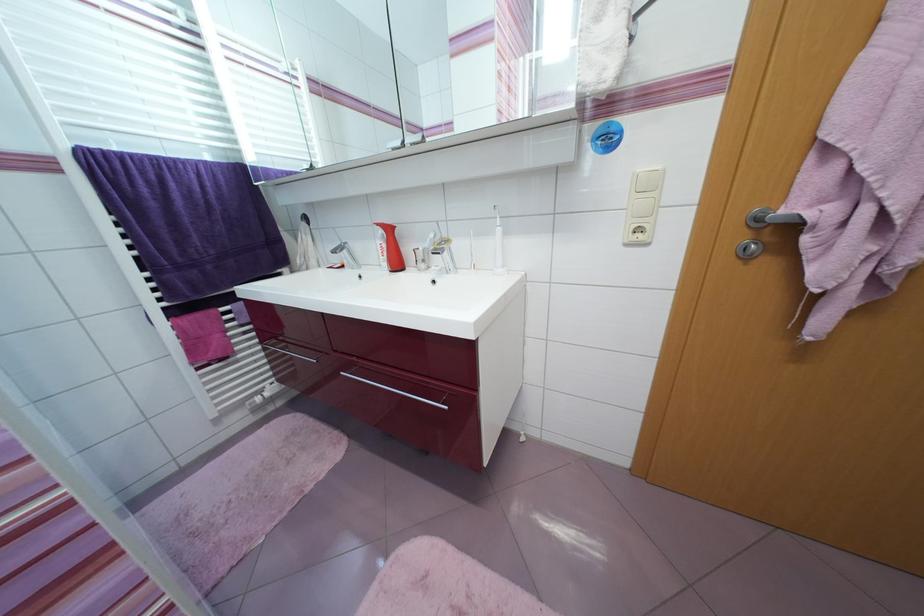
You are a GUI agent. You are given a task and a screenshot of the screen. Output one action in this format:
    pyautogui.click(x=<x>, y=<y>)
    Task: Click on the red dispenser pump
    The image size is (924, 616).
    Given the screenshot: What is the action you would take?
    (x=391, y=246)